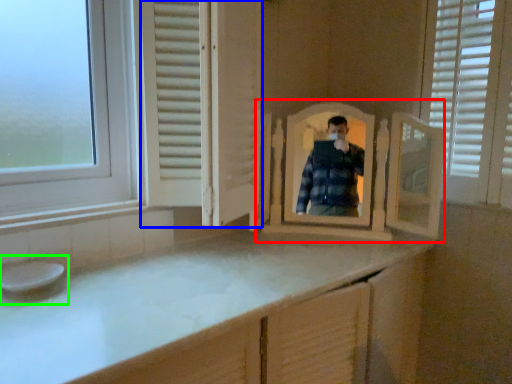
Question: Which is farther away from mirror (highlighted by a red box)? screen door (highlighted by a blue box) or sink (highlighted by a green box)?

Choices:
 (A) screen door
 (B) sink

Answer: (B)